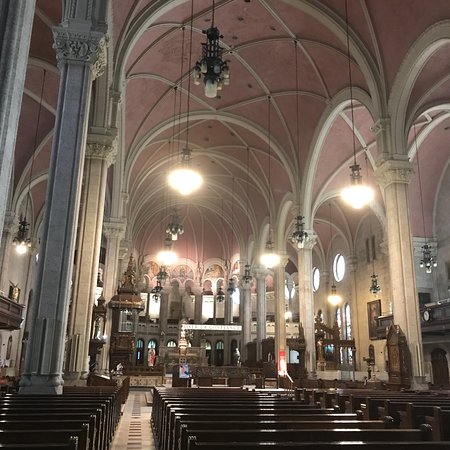
In order to click on round windows in this screenshot , I will do `click(342, 266)`, `click(316, 278)`, `click(287, 293)`.